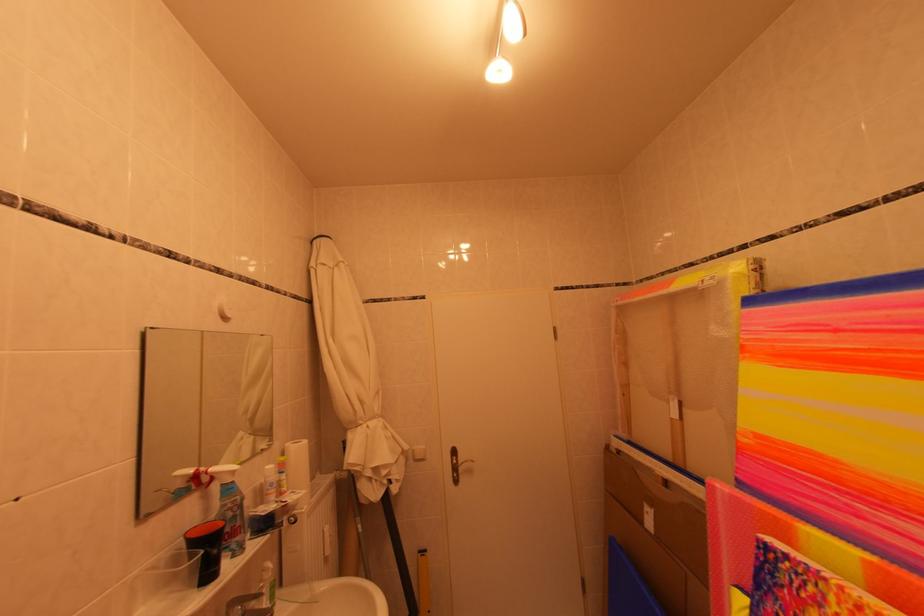
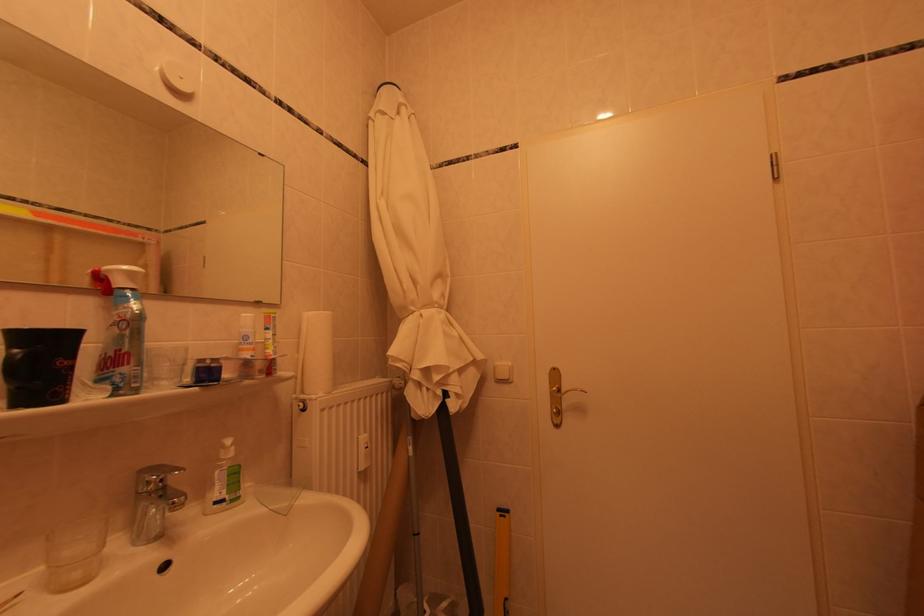
Where in the second image is the point corresponding to (x=249, y=538) from the first image?

(138, 368)